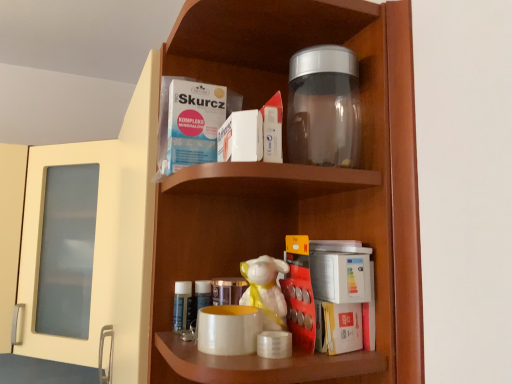
Question: Does transparent glass jar at upper center have a lesser height compared to white glossy figurine at center?

Choices:
 (A) no
 (B) yes

Answer: (A)

Question: From the image's perspective, is transparent glass jar at upper center located above white glossy figurine at center?

Choices:
 (A) no
 (B) yes

Answer: (B)

Question: From a real-world perspective, is transparent glass jar at upper center physically above white glossy figurine at center?

Choices:
 (A) yes
 (B) no

Answer: (A)

Question: Is transparent glass jar at upper center facing towards white glossy figurine at center?

Choices:
 (A) no
 (B) yes

Answer: (B)

Question: Could white glossy figurine at center be considered to be inside transparent glass jar at upper center?

Choices:
 (A) no
 (B) yes

Answer: (B)

Question: Is transparent plastic jar at upper center bigger or smaller than transparent glass jar at upper center?

Choices:
 (A) big
 (B) small

Answer: (B)

Question: Visually, is transparent plastic jar at upper center positioned to the left or to the right of transparent glass jar at upper center?

Choices:
 (A) right
 (B) left

Answer: (A)

Question: Is transparent plastic jar at upper center wider or thinner than transparent glass jar at upper center?

Choices:
 (A) thin
 (B) wide

Answer: (A)

Question: Does point (353, 89) appear closer or farther from the camera than point (416, 344)?

Choices:
 (A) closer
 (B) farther

Answer: (B)

Question: Is white glossy figurine at center taller or shorter than transparent glass jar at upper center?

Choices:
 (A) short
 (B) tall

Answer: (A)

Question: From the image's perspective, is white glossy figurine at center above or below transparent glass jar at upper center?

Choices:
 (A) below
 (B) above

Answer: (A)

Question: Is point (268, 326) positioned closer to the camera than point (267, 233)?

Choices:
 (A) closer
 (B) farther

Answer: (A)

Question: Visually, is white glossy figurine at center positioned to the left or to the right of transparent glass jar at upper center?

Choices:
 (A) left
 (B) right

Answer: (A)

Question: Is matte white mug at center wider or thinner than transparent plastic jar at upper center?

Choices:
 (A) wide
 (B) thin

Answer: (B)

Question: Would you say matte white mug at center is to the left or to the right of transparent plastic jar at upper center in the picture?

Choices:
 (A) left
 (B) right

Answer: (A)